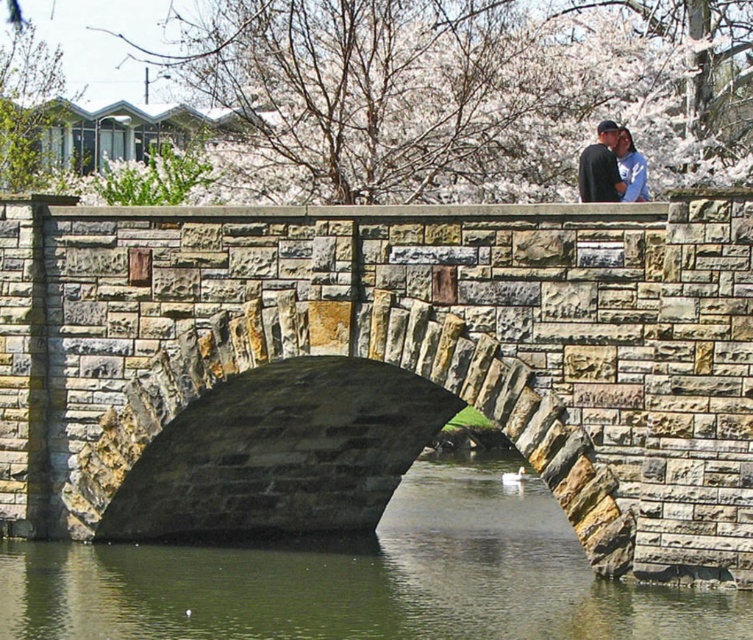
Which is below, green stone river at center or blue denim jacket at upper center?

green stone river at center

Between green stone river at center and blue denim jacket at upper center, which one appears on the left side from the viewer's perspective?

Positioned to the left is green stone river at center.

Measure the distance between point (303, 618) and camera.

Point (303, 618) and camera are 33.21 meters apart.

Find the location of a particular element. The image size is (753, 640). green stone river at center is located at coordinates (363, 579).

Is natural stone bridge at center bigger than green stone river at center?

Yes.

Between natural stone bridge at center and green stone river at center, which one is positioned higher?

natural stone bridge at center

This screenshot has width=753, height=640. What are the coordinates of `natural stone bridge at center` in the screenshot? It's located at (380, 365).

Which of these two, green stone river at center or matte black jacket at upper center, stands shorter?

Standing shorter between the two is green stone river at center.

Is green stone river at center to the left of matte black jacket at upper center from the viewer's perspective?

Yes, green stone river at center is to the left of matte black jacket at upper center.

The height and width of the screenshot is (640, 753). What do you see at coordinates (363, 579) in the screenshot?
I see `green stone river at center` at bounding box center [363, 579].

What are the coordinates of `green stone river at center` in the screenshot? It's located at (363, 579).